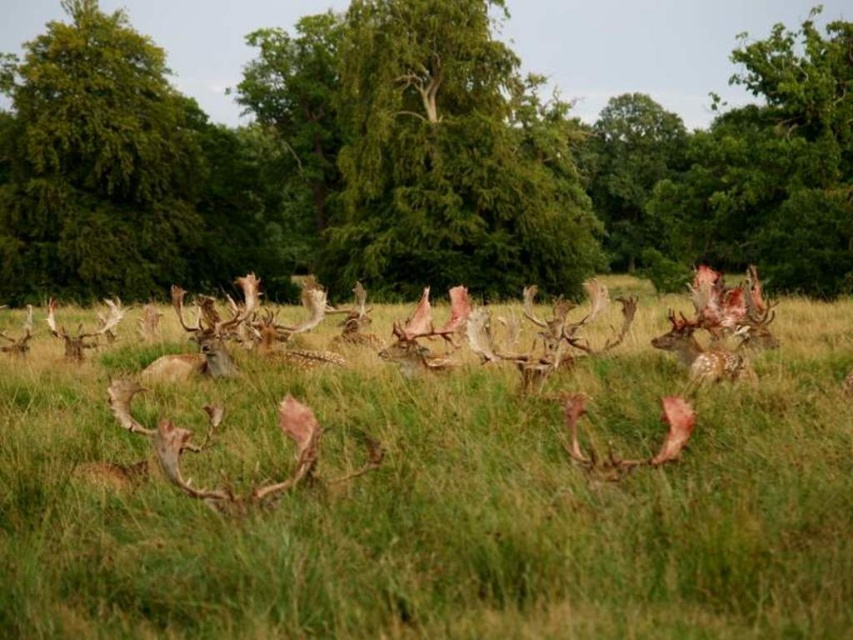
You are a photographer trying to capture a clear shot of the spotted fur antlers at center and the green leafy tree at center. Since you want both in focus, which one should you aim the camera at first?

The green leafy tree at center is positioned over spotted fur antlers at center, so you should aim the camera at the green leafy tree at center first to ensure both are in focus.